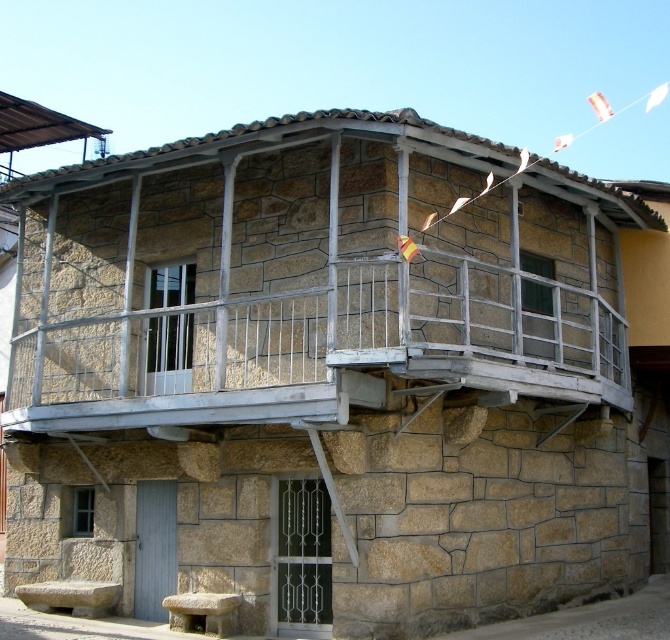
Is point (421, 145) positioned before point (198, 593)?

Yes, point (421, 145) is in front of point (198, 593).

What do you see at coordinates (308, 276) in the screenshot? I see `white wooden balcony at upper center` at bounding box center [308, 276].

Describe the element at coordinates (308, 276) in the screenshot. I see `white wooden balcony at upper center` at that location.

At what (x,y) coordinates should I click in order to perform the action: click on white wooden balcony at upper center. Please return your answer as a coordinate pair (x, y). Looking at the image, I should click on (308, 276).